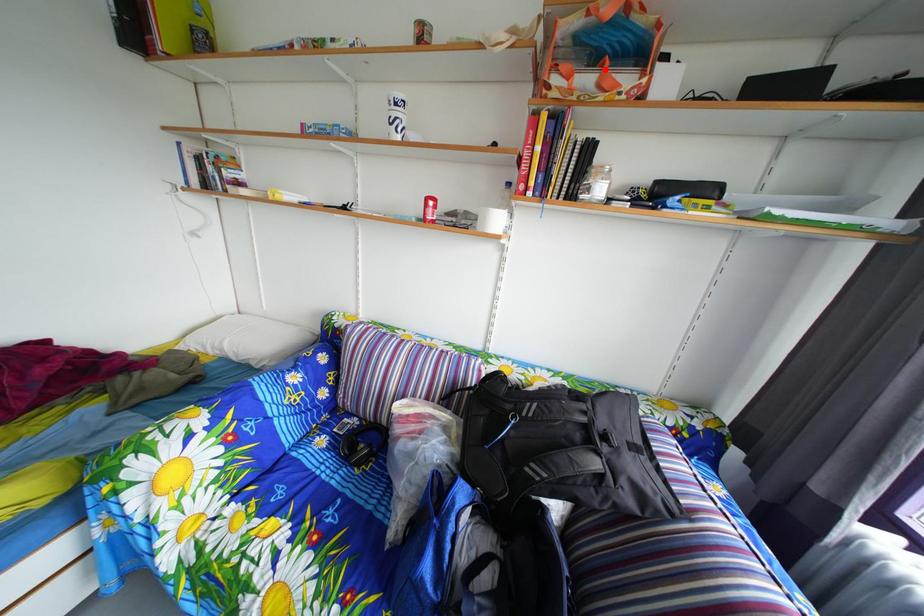
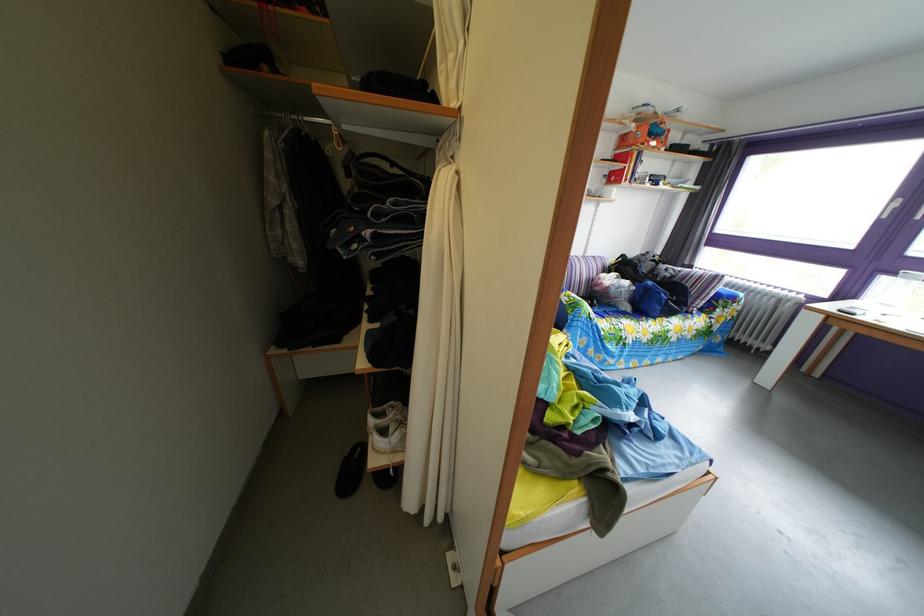
The point at the highlighted location is marked in the first image. Where is the corresponding point in the second image?

(661, 144)